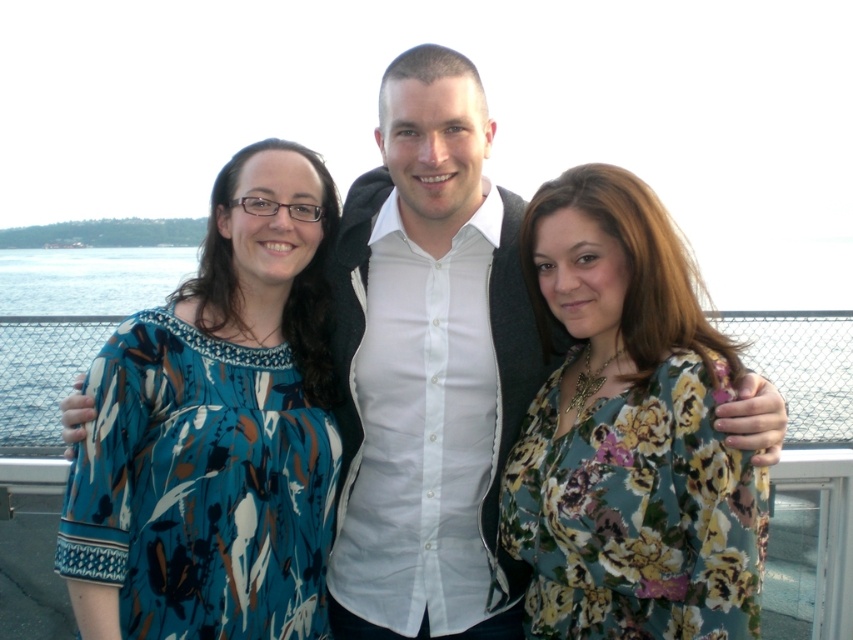
Is point (204, 387) positioned after point (490, 284)?

No, (204, 387) is in front of (490, 284).

Based on the photo, who is positioned more to the right, blue floral blouse at left or white matte shirt at center?

Positioned to the right is white matte shirt at center.

This screenshot has height=640, width=853. Identify the location of blue floral blouse at left. (216, 429).

Is point (200, 560) positioned behind point (619, 186)?

Yes, it is behind point (619, 186).

Identify the location of blue floral blouse at left. The height and width of the screenshot is (640, 853). (216, 429).

Which is more to the right, white matte shirt at center or floral print blouse at center?

floral print blouse at center is more to the right.

Who is more distant from viewer, [444,388] or [585,284]?

Point [444,388]

Between point (496, 579) and point (611, 246), which one is positioned in front?

Point (611, 246) is more forward.

This screenshot has height=640, width=853. What are the coordinates of `white matte shirt at center` in the screenshot? It's located at (428, 368).